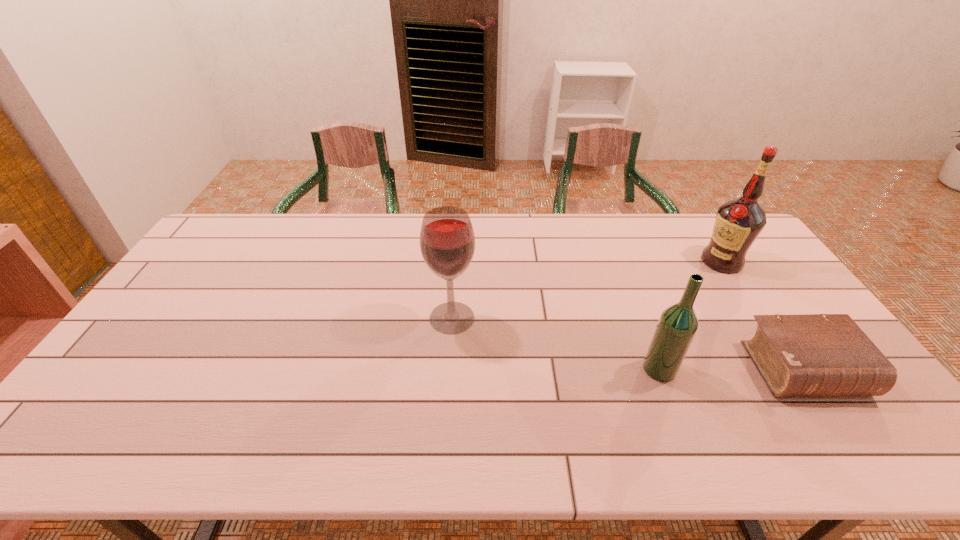
Find the location of a particular element. This screenshot has height=540, width=960. vacant space at the far left corner is located at coordinates (230, 229).

You are a GUI agent. You are given a task and a screenshot of the screen. Output one action in this format:
    pyautogui.click(x=<x>, y=<y>)
    Task: Click on the free area in between the leftmost object and the Bible
    Image resolution: width=960 pixels, height=540 pixels.
    Given the screenshot: What is the action you would take?
    pyautogui.click(x=628, y=343)

I want to click on free space between the farthest alcohol and the second nearest alcohol, so click(587, 289).

Find the location of a particular element. This screenshot has height=540, width=960. vacant space that is in between the leftmost object and the shortest object is located at coordinates (628, 343).

Where is `vacant space that is in between the Bible and the nearest alcohol`? vacant space that is in between the Bible and the nearest alcohol is located at coordinates (732, 369).

This screenshot has width=960, height=540. What are the coordinates of `free space that is in between the second alcohol from left to right and the leftmost alcohol` in the screenshot? It's located at point(556,343).

Locate an element on the screen. The image size is (960, 540). free spot between the second alcohol from left to right and the Bible is located at coordinates (732, 369).

Choose which object is the nearest neighbor to the shortest object. Please provide its 2D coordinates. Your answer should be formatted as a tuple, i.e. [(x, y)], where the tuple contains the x and y coordinates of a point satisfying the conditions above.

[(676, 328)]

Find the location of `object that is the third nearest to the second alcohol from left to right`. object that is the third nearest to the second alcohol from left to right is located at coordinates [x=447, y=241].

Locate an element on the screen. alcohol that is the second nearest to the nearest alcohol is located at coordinates (447, 241).